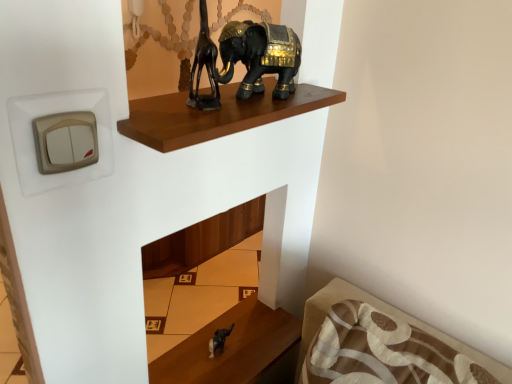
Question: Is brown polished wood shelf at upper center completely or partially inside satin black elephant at lower center?

Choices:
 (A) yes
 (B) no

Answer: (B)

Question: Is satin black elephant at lower center in front of brown polished wood shelf at upper center?

Choices:
 (A) no
 (B) yes

Answer: (A)

Question: From a real-world perspective, is satin black elephant at lower center under brown polished wood shelf at upper center?

Choices:
 (A) yes
 (B) no

Answer: (A)

Question: Considering the relative positions of satin black elephant at lower center and brown polished wood shelf at upper center in the image provided, is satin black elephant at lower center to the right of brown polished wood shelf at upper center from the viewer's perspective?

Choices:
 (A) no
 (B) yes

Answer: (A)

Question: Is satin black elephant at lower center to the left of brown polished wood shelf at upper center from the viewer's perspective?

Choices:
 (A) yes
 (B) no

Answer: (A)

Question: Does satin black elephant at lower center have a smaller size compared to brown polished wood shelf at upper center?

Choices:
 (A) yes
 (B) no

Answer: (B)

Question: Is the surface of brown polished wood shelf at upper center in direct contact with satin black elephant at lower center?

Choices:
 (A) no
 (B) yes

Answer: (A)

Question: Is brown polished wood shelf at upper center facing towards satin black elephant at lower center?

Choices:
 (A) no
 (B) yes

Answer: (A)

Question: Does brown polished wood shelf at upper center come behind satin black elephant at lower center?

Choices:
 (A) no
 (B) yes

Answer: (A)

Question: From a real-world perspective, is brown polished wood shelf at upper center over satin black elephant at lower center?

Choices:
 (A) yes
 (B) no

Answer: (A)

Question: Is brown polished wood shelf at upper center positioned with its back to satin black elephant at lower center?

Choices:
 (A) no
 (B) yes

Answer: (A)

Question: From the image's perspective, would you say brown polished wood shelf at upper center is positioned over satin black elephant at lower center?

Choices:
 (A) yes
 (B) no

Answer: (A)

Question: Considering the relative sizes of satin black elephant at lower center and black glossy elephant at upper center in the image provided, is satin black elephant at lower center shorter than black glossy elephant at upper center?

Choices:
 (A) yes
 (B) no

Answer: (A)